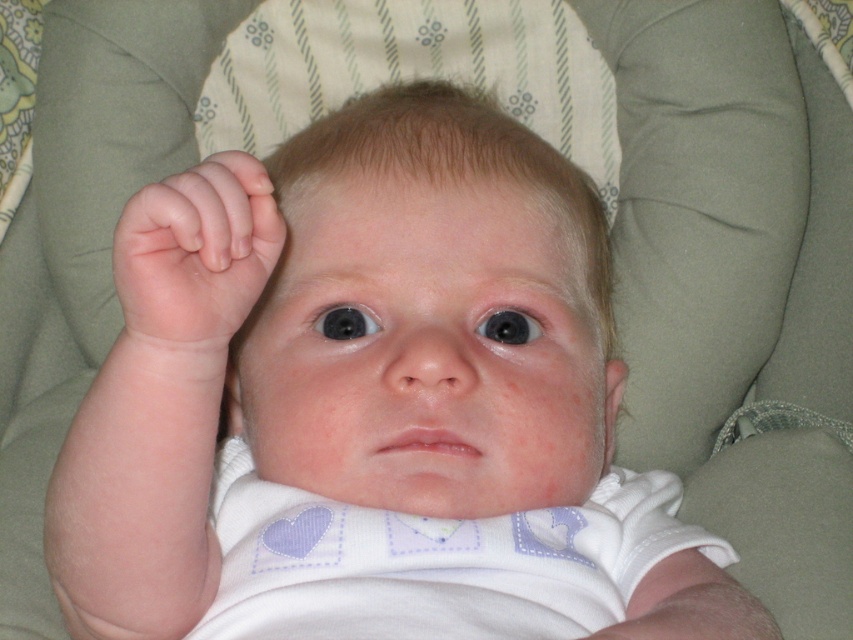
Question: Is smooth skin head at center below pink flesh-toned hand at upper left?

Choices:
 (A) no
 (B) yes

Answer: (A)

Question: Considering the relative positions of smooth skin head at center and pink flesh-toned hand at upper left in the image provided, where is smooth skin head at center located with respect to pink flesh-toned hand at upper left?

Choices:
 (A) right
 (B) left

Answer: (A)

Question: Which point is closer to the camera?

Choices:
 (A) pink flesh-toned hand at upper left
 (B) smooth skin head at center

Answer: (A)

Question: Can you confirm if smooth skin head at center is smaller than pink flesh-toned hand at upper left?

Choices:
 (A) yes
 (B) no

Answer: (B)

Question: Among these points, which one is farthest from the camera?

Choices:
 (A) (521, 458)
 (B) (213, 298)

Answer: (A)